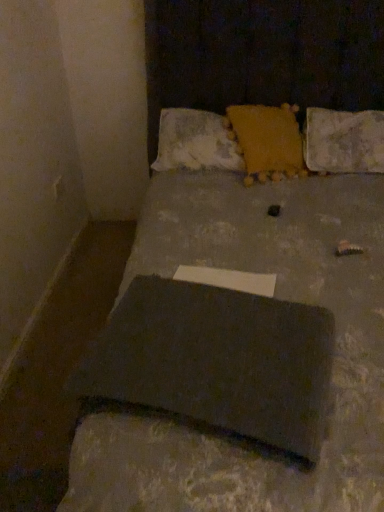
Question: Which direction should I rotate to face textured yellow pillow at center, which is counted as the first pillow, starting from the left, — up or down?

Choices:
 (A) up
 (B) down

Answer: (A)

Question: Is slate at center to the right of textured yellow pillow at upper right, marked as the 3th pillow in a left-to-right arrangement, from the viewer's perspective?

Choices:
 (A) yes
 (B) no

Answer: (B)

Question: Is slate at center completely or partially outside of textured yellow pillow at upper right, marked as the 3th pillow in a left-to-right arrangement?

Choices:
 (A) yes
 (B) no

Answer: (A)

Question: From a real-world perspective, is slate at center physically above textured yellow pillow at upper right, marked as the 3th pillow in a left-to-right arrangement?

Choices:
 (A) no
 (B) yes

Answer: (A)

Question: Could textured yellow pillow at upper right, which is counted as the first pillow, starting from the right, be considered to be inside slate at center?

Choices:
 (A) no
 (B) yes

Answer: (A)

Question: Can you confirm if slate at center is positioned to the left of textured yellow pillow at upper right, which is counted as the first pillow, starting from the right?

Choices:
 (A) yes
 (B) no

Answer: (A)

Question: Does slate at center have a larger size compared to textured yellow pillow at upper right, marked as the 3th pillow in a left-to-right arrangement?

Choices:
 (A) no
 (B) yes

Answer: (A)

Question: From a real-world perspective, is yellow fuzzy pillow at upper center, the second pillow viewed from the right, on matte gray laptop at center?

Choices:
 (A) no
 (B) yes

Answer: (B)

Question: Is the position of yellow fuzzy pillow at upper center, placed as the second pillow when sorted from left to right, less distant than that of matte gray laptop at center?

Choices:
 (A) no
 (B) yes

Answer: (A)

Question: Is matte gray laptop at center completely or partially inside yellow fuzzy pillow at upper center, placed as the second pillow when sorted from left to right?

Choices:
 (A) no
 (B) yes

Answer: (A)

Question: From a real-world perspective, is yellow fuzzy pillow at upper center, placed as the second pillow when sorted from left to right, located beneath matte gray laptop at center?

Choices:
 (A) no
 (B) yes

Answer: (A)

Question: Does yellow fuzzy pillow at upper center, the second pillow viewed from the right, have a lesser height compared to matte gray laptop at center?

Choices:
 (A) no
 (B) yes

Answer: (B)

Question: Is yellow fuzzy pillow at upper center, placed as the second pillow when sorted from left to right, facing towards matte gray laptop at center?

Choices:
 (A) no
 (B) yes

Answer: (B)

Question: Can you confirm if slate at center is thinner than matte gray laptop at center?

Choices:
 (A) yes
 (B) no

Answer: (A)